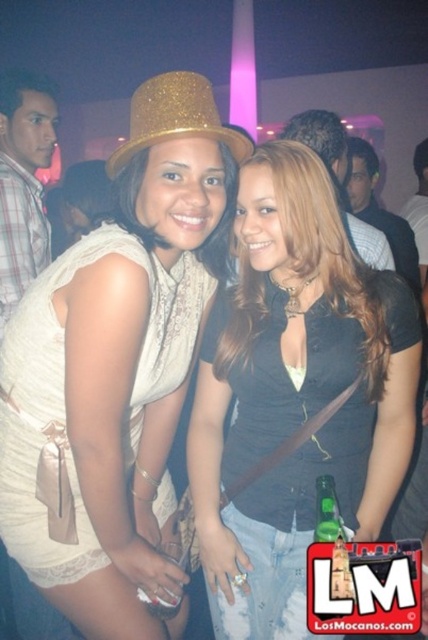
You are at a party and want to take a photo of the two women in the scene. The photographer says that the matte gold glitter hat at center might block the view of the matte black top at center. Is this possible?

The matte gold glitter hat at center is taller than the matte black top at center, so it could potentially block the view of the matte black top at center if positioned in front.

You are a photographer adjusting the camera focus. You need to ensure that both the matte black top at center and the gold glittery hat at center are in focus. Given that the camera can only focus on objects within a 10 cm width range, will both items fit within this range?

The matte black top at center is wider than the gold glittery hat at center. However, since the camera can focus on a 10 cm width range, both items should fit within this range as their combined width difference is within the 10 cm limit.